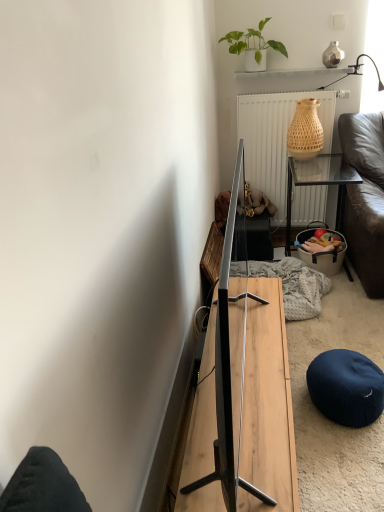
Locate an element on the screen. This screenshot has height=512, width=384. free location above light wood table at center, arranged as the second table when viewed from the right (from a real-world perspective) is located at coordinates (261, 356).